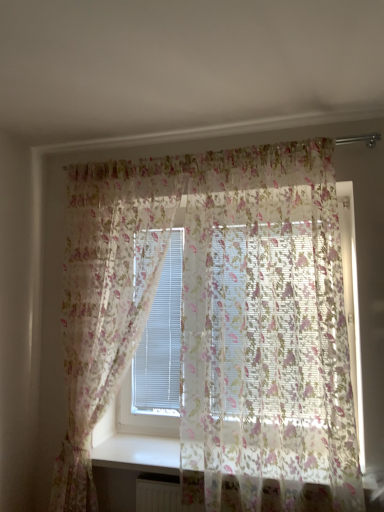
Identify the location of translucent floral curtain at upper center, the 1th curtain from the right. (218, 320).

What do you see at coordinates (218, 320) in the screenshot? Image resolution: width=384 pixels, height=512 pixels. I see `translucent floral curtain at upper center, arranged as the second curtain when viewed from the left` at bounding box center [218, 320].

You are a GUI agent. You are given a task and a screenshot of the screen. Output one action in this format:
    pyautogui.click(x=<x>, y=<y>)
    Task: Click on the translucent floral fabric at center, which is the 2th curtain in right-to-left order
    
    Given the screenshot: What is the action you would take?
    pyautogui.click(x=107, y=296)

What do you see at coordinates (107, 296) in the screenshot? The image size is (384, 512). I see `translucent floral fabric at center, which is the 2th curtain in right-to-left order` at bounding box center [107, 296].

What are the coordinates of `translucent floral curtain at upper center, arranged as the second curtain when viewed from the left` in the screenshot? It's located at (218, 320).

Considering the relative positions of translucent floral fabric at center, the 1th curtain viewed from the left, and translucent floral curtain at upper center, the 1th curtain from the right, in the image provided, is translucent floral fabric at center, the 1th curtain viewed from the left, to the right of translucent floral curtain at upper center, the 1th curtain from the right, from the viewer's perspective?

No, translucent floral fabric at center, the 1th curtain viewed from the left, is not to the right of translucent floral curtain at upper center, the 1th curtain from the right.

Which object is closer to the camera taking this photo, translucent floral fabric at center, which is the 2th curtain in right-to-left order, or translucent floral curtain at upper center, arranged as the second curtain when viewed from the left?

translucent floral curtain at upper center, arranged as the second curtain when viewed from the left, is in front.

Which is further, (x=130, y=271) or (x=278, y=278)?

The point (x=130, y=271) is more distant.

From the image's perspective, is translucent floral fabric at center, which is the 2th curtain in right-to-left order, above or below translucent floral curtain at upper center, arranged as the second curtain when viewed from the left?

translucent floral fabric at center, which is the 2th curtain in right-to-left order, is situated lower than translucent floral curtain at upper center, arranged as the second curtain when viewed from the left, in the image.

From a real-world perspective, is translucent floral fabric at center, the 1th curtain viewed from the left, physically located above or below translucent floral curtain at upper center, arranged as the second curtain when viewed from the left?

translucent floral fabric at center, the 1th curtain viewed from the left, is below translucent floral curtain at upper center, arranged as the second curtain when viewed from the left.

Which object is thinner, translucent floral fabric at center, the 1th curtain viewed from the left, or translucent floral curtain at upper center, arranged as the second curtain when viewed from the left?

With smaller width is translucent floral fabric at center, the 1th curtain viewed from the left.

Who is shorter, translucent floral fabric at center, the 1th curtain viewed from the left, or translucent floral curtain at upper center, the 1th curtain from the right?

translucent floral curtain at upper center, the 1th curtain from the right, is shorter.

Does translucent floral fabric at center, which is the 2th curtain in right-to-left order, have a larger size compared to translucent floral curtain at upper center, the 1th curtain from the right?

No, translucent floral fabric at center, which is the 2th curtain in right-to-left order, is not bigger than translucent floral curtain at upper center, the 1th curtain from the right.

Could translucent floral curtain at upper center, arranged as the second curtain when viewed from the left, be considered to be inside translucent floral fabric at center, which is the 2th curtain in right-to-left order?

No, translucent floral curtain at upper center, arranged as the second curtain when viewed from the left, is not surrounded by translucent floral fabric at center, which is the 2th curtain in right-to-left order.

Is translucent floral fabric at center, the 1th curtain viewed from the left, placed right next to translucent floral curtain at upper center, the 1th curtain from the right?

No, translucent floral fabric at center, the 1th curtain viewed from the left, is not with translucent floral curtain at upper center, the 1th curtain from the right.

Is translucent floral fabric at center, the 1th curtain viewed from the left, turned away from translucent floral curtain at upper center, arranged as the second curtain when viewed from the left?

No, translucent floral fabric at center, the 1th curtain viewed from the left, is not facing away from translucent floral curtain at upper center, arranged as the second curtain when viewed from the left.

What are the coordinates of `curtain lying on the left of translucent floral curtain at upper center, arranged as the second curtain when viewed from the left` in the screenshot? It's located at (107, 296).

Which object is positioned more to the right, translucent floral curtain at upper center, arranged as the second curtain when viewed from the left, or translucent floral fabric at center, which is the 2th curtain in right-to-left order?

Positioned to the right is translucent floral curtain at upper center, arranged as the second curtain when viewed from the left.

Which object is further away from the camera, translucent floral curtain at upper center, the 1th curtain from the right, or translucent floral fabric at center, the 1th curtain viewed from the left?

translucent floral fabric at center, the 1th curtain viewed from the left, is behind.

Which is in front, point (205, 376) or point (122, 223)?

Positioned in front is point (205, 376).

From the image's perspective, is translucent floral curtain at upper center, the 1th curtain from the right, located beneath translucent floral fabric at center, the 1th curtain viewed from the left?

No.

From a real-world perspective, does translucent floral curtain at upper center, arranged as the second curtain when viewed from the left, sit lower than translucent floral fabric at center, which is the 2th curtain in right-to-left order?

No.

Looking at this image, considering the sizes of objects translucent floral curtain at upper center, arranged as the second curtain when viewed from the left, and translucent floral fabric at center, which is the 2th curtain in right-to-left order, in the image provided, who is wider, translucent floral curtain at upper center, arranged as the second curtain when viewed from the left, or translucent floral fabric at center, which is the 2th curtain in right-to-left order,?

translucent floral curtain at upper center, arranged as the second curtain when viewed from the left, is wider.

Between translucent floral curtain at upper center, arranged as the second curtain when viewed from the left, and translucent floral fabric at center, which is the 2th curtain in right-to-left order, which one has more height?

With more height is translucent floral fabric at center, which is the 2th curtain in right-to-left order.

Which of these two, translucent floral curtain at upper center, the 1th curtain from the right, or translucent floral fabric at center, the 1th curtain viewed from the left, is bigger?

translucent floral curtain at upper center, the 1th curtain from the right.

From the picture: Which is correct: translucent floral curtain at upper center, arranged as the second curtain when viewed from the left, is inside translucent floral fabric at center, which is the 2th curtain in right-to-left order, or outside of it?

translucent floral curtain at upper center, arranged as the second curtain when viewed from the left, is spatially situated outside translucent floral fabric at center, which is the 2th curtain in right-to-left order.

Are translucent floral curtain at upper center, arranged as the second curtain when viewed from the left, and translucent floral fabric at center, which is the 2th curtain in right-to-left order, beside each other?

translucent floral curtain at upper center, arranged as the second curtain when viewed from the left, and translucent floral fabric at center, which is the 2th curtain in right-to-left order, are not in contact.

Is translucent floral curtain at upper center, the 1th curtain from the right, turned away from translucent floral fabric at center, the 1th curtain viewed from the left?

No.

Locate an element on the screen. This screenshot has height=512, width=384. curtain above the translucent floral fabric at center, the 1th curtain viewed from the left (from the image's perspective) is located at coordinates (218, 320).

At what (x,y) coordinates should I click in order to perform the action: click on curtain above the translucent floral fabric at center, the 1th curtain viewed from the left (from a real-world perspective). Please return your answer as a coordinate pair (x, y). Image resolution: width=384 pixels, height=512 pixels. Looking at the image, I should click on (218, 320).

Where is `curtain lying above the translucent floral fabric at center, which is the 2th curtain in right-to-left order (from the image's perspective)`? The width and height of the screenshot is (384, 512). curtain lying above the translucent floral fabric at center, which is the 2th curtain in right-to-left order (from the image's perspective) is located at coordinates (218, 320).